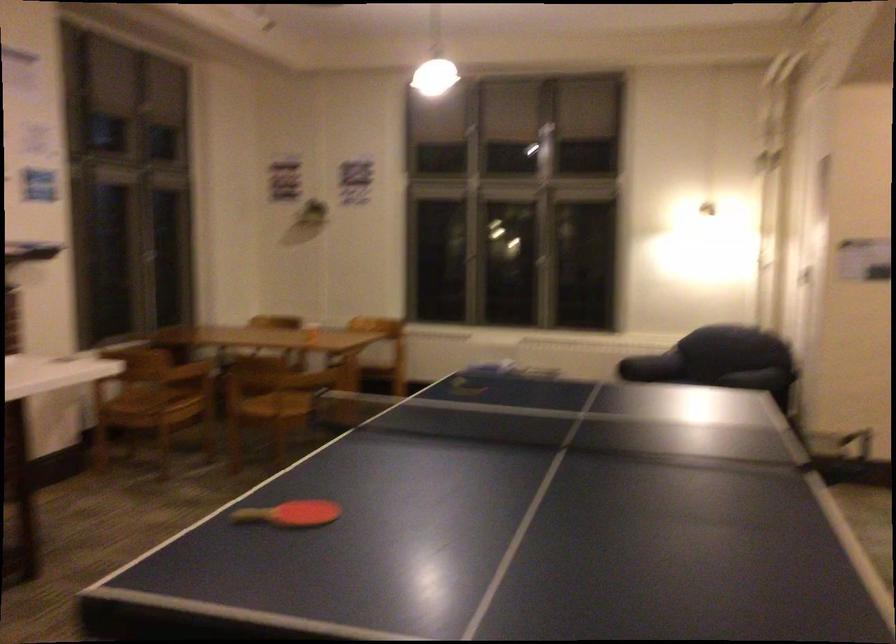
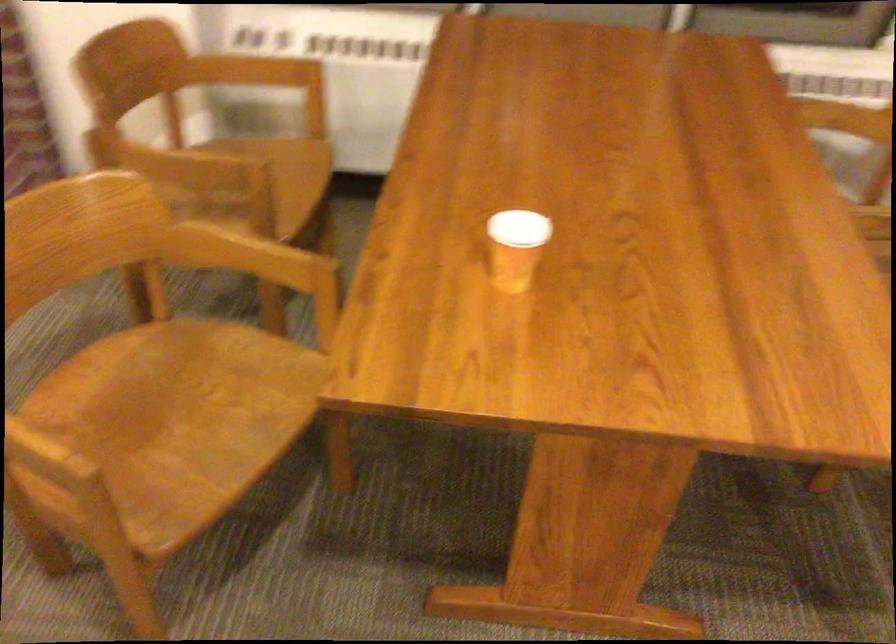
In the second image, find the point that corresponds to (x=186, y=373) in the first image.

(169, 163)